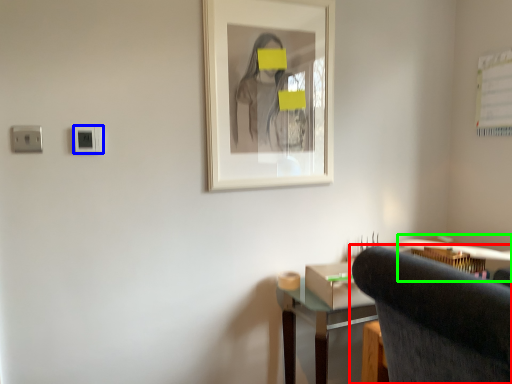
Question: Which object is positioned closest to chair (highlighted by a red box)? Select from electric outlet (highlighted by a blue box) and computer desk (highlighted by a green box).

Choices:
 (A) electric outlet
 (B) computer desk

Answer: (B)